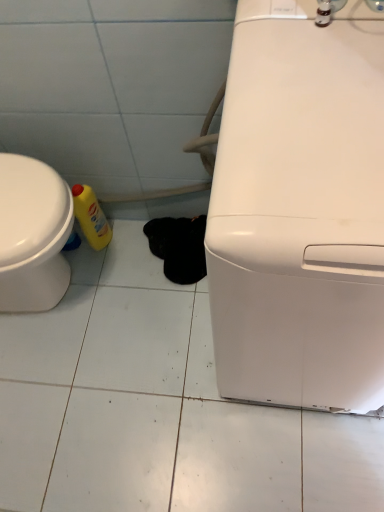
Question: From a real-world perspective, is yellow plastic bottle at lower left positioned over white glossy washing machine at right based on gravity?

Choices:
 (A) no
 (B) yes

Answer: (A)

Question: Could you tell me if yellow plastic bottle at lower left is turned towards white glossy washing machine at right?

Choices:
 (A) yes
 (B) no

Answer: (A)

Question: Is white glossy washing machine at right at the back of yellow plastic bottle at lower left?

Choices:
 (A) no
 (B) yes

Answer: (A)

Question: Can you confirm if yellow plastic bottle at lower left is bigger than white glossy washing machine at right?

Choices:
 (A) yes
 (B) no

Answer: (B)

Question: From the image's perspective, is yellow plastic bottle at lower left on top of white glossy washing machine at right?

Choices:
 (A) no
 (B) yes

Answer: (B)

Question: Can you confirm if yellow plastic bottle at lower left is thinner than white glossy washing machine at right?

Choices:
 (A) yes
 (B) no

Answer: (A)

Question: Could you tell me if white glossy washing machine at right is facing yellow plastic bottle at lower left?

Choices:
 (A) yes
 (B) no

Answer: (B)

Question: Is white glossy washing machine at right directly adjacent to yellow plastic bottle at lower left?

Choices:
 (A) yes
 (B) no

Answer: (B)

Question: From the image's perspective, does white glossy washing machine at right appear lower than yellow plastic bottle at lower left?

Choices:
 (A) no
 (B) yes

Answer: (B)

Question: Does white glossy washing machine at right come in front of yellow plastic bottle at lower left?

Choices:
 (A) no
 (B) yes

Answer: (B)

Question: Could yellow plastic bottle at lower left be considered to be inside white glossy washing machine at right?

Choices:
 (A) yes
 (B) no

Answer: (B)

Question: Would you consider white glossy washing machine at right to be distant from yellow plastic bottle at lower left?

Choices:
 (A) yes
 (B) no

Answer: (B)

Question: Considering the positions of point (360, 376) and point (104, 238), is point (360, 376) closer or farther from the camera than point (104, 238)?

Choices:
 (A) closer
 (B) farther

Answer: (A)